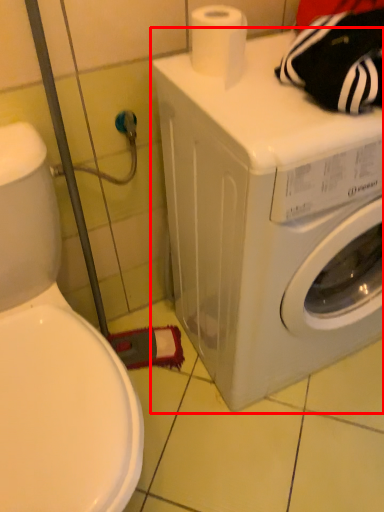
Question: In this image, where is washing machine (annotated by the red box) located relative to toilet paper?

Choices:
 (A) right
 (B) left

Answer: (A)